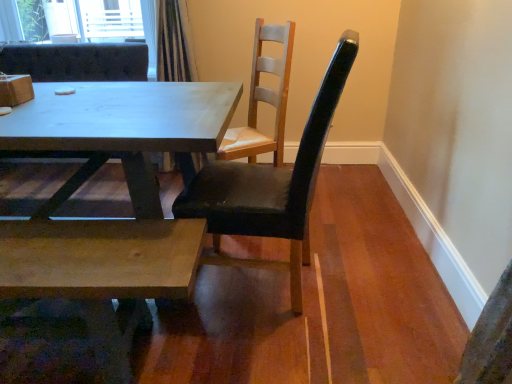
Question: Would you consider black leather chair at center, the first chair viewed from the right, to be distant from matte white chair at center, placed as the 1th chair when sorted from left to right?

Choices:
 (A) no
 (B) yes

Answer: (B)

Question: Is black leather chair at center, acting as the 3th chair starting from the left, in contact with matte white chair at center, arranged as the third chair when viewed from the right?

Choices:
 (A) yes
 (B) no

Answer: (B)

Question: Is matte white chair at center, arranged as the third chair when viewed from the right, at the back of black leather chair at center, acting as the 3th chair starting from the left?

Choices:
 (A) yes
 (B) no

Answer: (B)

Question: Is black leather chair at center, the first chair viewed from the right, thinner than matte white chair at center, placed as the 1th chair when sorted from left to right?

Choices:
 (A) no
 (B) yes

Answer: (B)

Question: Can you confirm if black leather chair at center, the first chair viewed from the right, is taller than matte white chair at center, arranged as the third chair when viewed from the right?

Choices:
 (A) yes
 (B) no

Answer: (A)

Question: Considering the positions of natural wood coffee table at lower left and black leather chair at center, the first chair viewed from the right, in the image, is natural wood coffee table at lower left taller or shorter than black leather chair at center, the first chair viewed from the right,?

Choices:
 (A) tall
 (B) short

Answer: (B)

Question: Considering the positions of point (22, 279) and point (254, 200), is point (22, 279) closer or farther from the camera than point (254, 200)?

Choices:
 (A) farther
 (B) closer

Answer: (B)

Question: In terms of size, does natural wood coffee table at lower left appear bigger or smaller than black leather chair at center, the first chair viewed from the right?

Choices:
 (A) big
 (B) small

Answer: (B)

Question: Is natural wood coffee table at lower left wider or thinner than black leather chair at center, acting as the 3th chair starting from the left?

Choices:
 (A) thin
 (B) wide

Answer: (A)

Question: In terms of size, does black leather chair at center, the first chair viewed from the right, appear bigger or smaller than light brown wood chair at upper center, acting as the second chair starting from the left?

Choices:
 (A) small
 (B) big

Answer: (B)

Question: Is black leather chair at center, acting as the 3th chair starting from the left, wider or thinner than light brown wood chair at upper center, the second chair when ordered from right to left?

Choices:
 (A) thin
 (B) wide

Answer: (B)

Question: From a real-world perspective, is black leather chair at center, the first chair viewed from the right, above or below light brown wood chair at upper center, acting as the second chair starting from the left?

Choices:
 (A) below
 (B) above

Answer: (A)

Question: In the image, is black leather chair at center, acting as the 3th chair starting from the left, positioned in front of or behind light brown wood chair at upper center, acting as the second chair starting from the left?

Choices:
 (A) behind
 (B) front

Answer: (B)

Question: Looking at the image, does light brown wood chair at upper center, acting as the second chair starting from the left, seem bigger or smaller compared to matte white chair at center, placed as the 1th chair when sorted from left to right?

Choices:
 (A) small
 (B) big

Answer: (A)

Question: From their relative heights in the image, would you say light brown wood chair at upper center, acting as the second chair starting from the left, is taller or shorter than matte white chair at center, arranged as the third chair when viewed from the right?

Choices:
 (A) tall
 (B) short

Answer: (B)